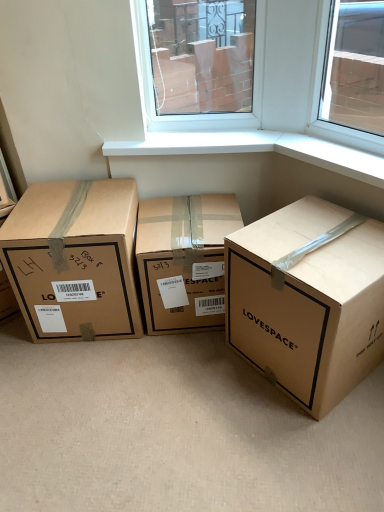
At what (x,y) coordinates should I click in order to perform the action: click on free spot to the left of brown cardboard box at center, acting as the first box starting from the right. Please return your answer as a coordinate pair (x, y). This screenshot has width=384, height=512. Looking at the image, I should click on (206, 374).